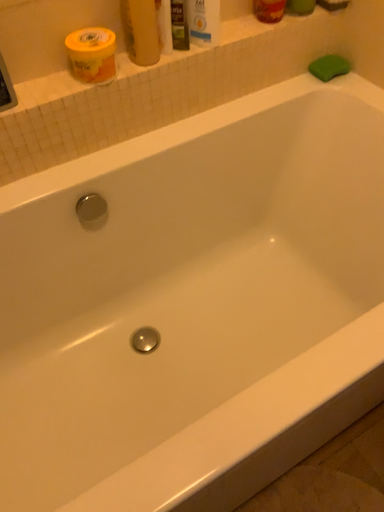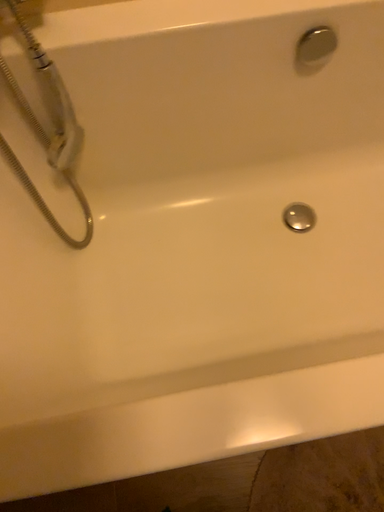
Question: Which way did the camera rotate in the video?

Choices:
 (A) rotated left
 (B) rotated right

Answer: (A)